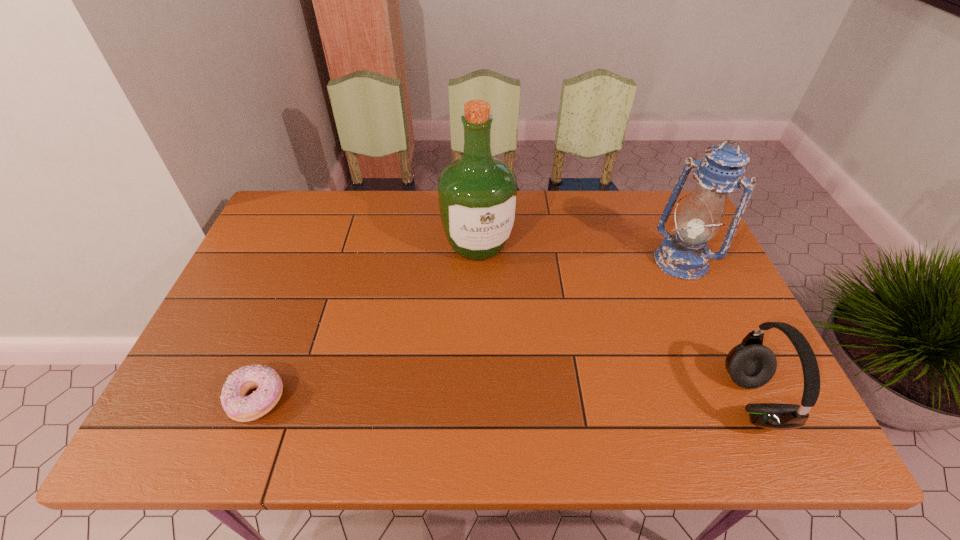
Image resolution: width=960 pixels, height=540 pixels. I want to click on the shortest object, so click(x=239, y=407).

This screenshot has height=540, width=960. I want to click on doughnut, so click(239, 407).

You are a GUI agent. You are given a task and a screenshot of the screen. Output one action in this format:
    pyautogui.click(x=<x>, y=<y>)
    Task: Click on the headset
    The height and width of the screenshot is (540, 960).
    Given the screenshot: What is the action you would take?
    pyautogui.click(x=750, y=364)

At what (x,y) coordinates should I click in order to perform the action: click on liquor. Please return your answer as a coordinate pair (x, y). Image resolution: width=960 pixels, height=540 pixels. Looking at the image, I should click on (478, 193).

The width and height of the screenshot is (960, 540). Find the location of `lantern`. lantern is located at coordinates (685, 255).

Identify the location of vacant space located on the back of the leftmost object. (311, 261).

You are a GUI agent. You are given a task and a screenshot of the screen. Output one action in this format:
    pyautogui.click(x=<x>, y=<y>)
    Task: Click on the free location located on the ear cups of the third tallest object
    This screenshot has height=540, width=960.
    Given the screenshot: What is the action you would take?
    pyautogui.click(x=621, y=400)

Where is `vacant point located on the ear cups of the third tallest object`? vacant point located on the ear cups of the third tallest object is located at coordinates (684, 400).

In order to click on blank space located on the ear cups of the third tallest object in this screenshot , I will do `click(598, 400)`.

You are a GUI agent. You are given a task and a screenshot of the screen. Output one action in this format:
    pyautogui.click(x=<x>, y=<y>)
    Task: Click on the vacant space situated on the front-facing side of the liquor
    Image resolution: width=960 pixels, height=540 pixels.
    Given the screenshot: What is the action you would take?
    pyautogui.click(x=509, y=322)